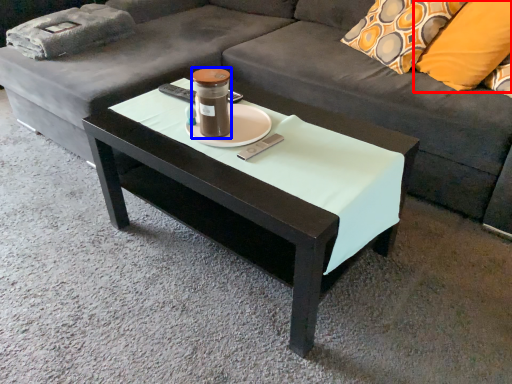
Question: Which of the following is the farthest to the observer, pillow (highlighted by a red box) or candle holder (highlighted by a blue box)?

Choices:
 (A) pillow
 (B) candle holder

Answer: (A)